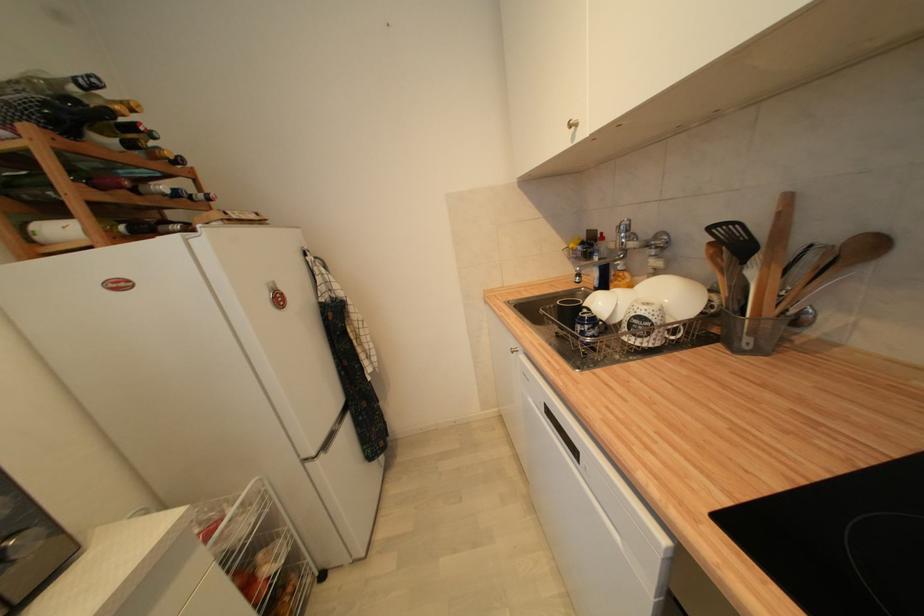
What do you see at coordinates (601, 265) in the screenshot?
I see `the soap dispenser pump` at bounding box center [601, 265].